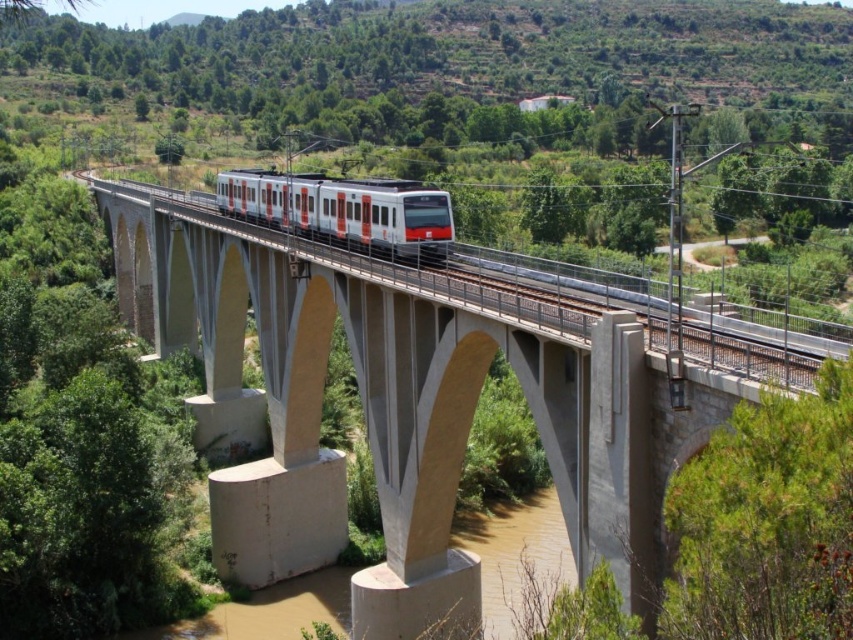
Is white concrete bridge at center further to camera compared to white glossy train at center?

No, white concrete bridge at center is closer to the viewer.

Which is above, white concrete bridge at center or white glossy train at center?

white glossy train at center is higher up.

This screenshot has height=640, width=853. Identify the location of white concrete bridge at center. (407, 401).